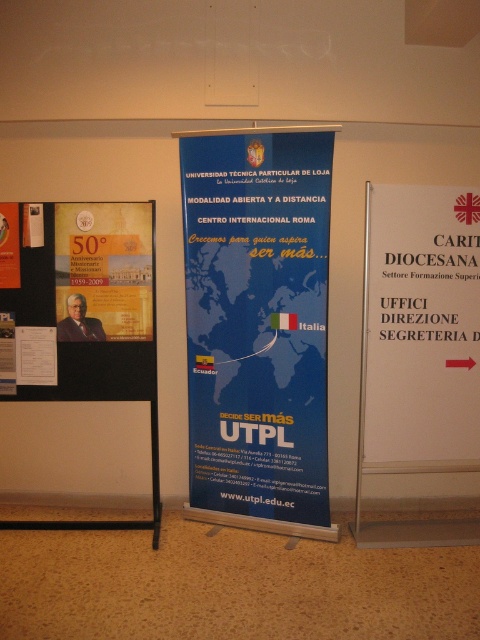
Question: Is white paper sign at right to the left of matte gold poster at left from the viewer's perspective?

Choices:
 (A) yes
 (B) no

Answer: (B)

Question: Considering the real-world distances, which object is farthest from the matte gold paper at left?

Choices:
 (A) gold paper poster at left
 (B) matte gold poster at left

Answer: (B)

Question: Which point is farther to the camera?

Choices:
 (A) gold paper poster at left
 (B) matte gold poster at left
 (C) matte gold paper at left
 (D) white paper sign at right

Answer: (B)

Question: Is matte gold paper at left to the right of matte gold poster at left from the viewer's perspective?

Choices:
 (A) yes
 (B) no

Answer: (A)

Question: In this image, where is white paper sign at right located relative to gold paper poster at left?

Choices:
 (A) left
 (B) right

Answer: (B)

Question: Which of these objects is positioned closest to the matte gold paper at left?

Choices:
 (A) matte gold poster at left
 (B) gold paper poster at left

Answer: (B)